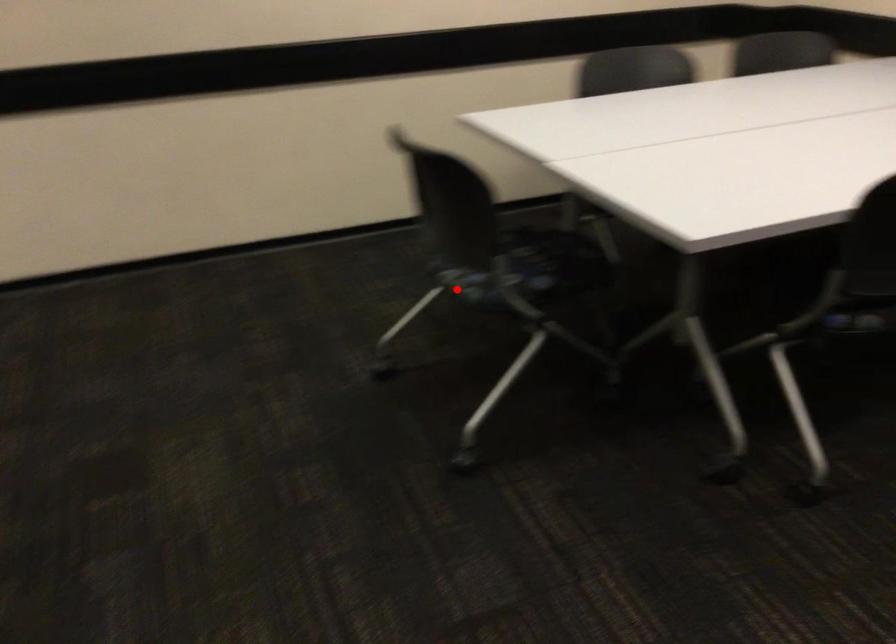
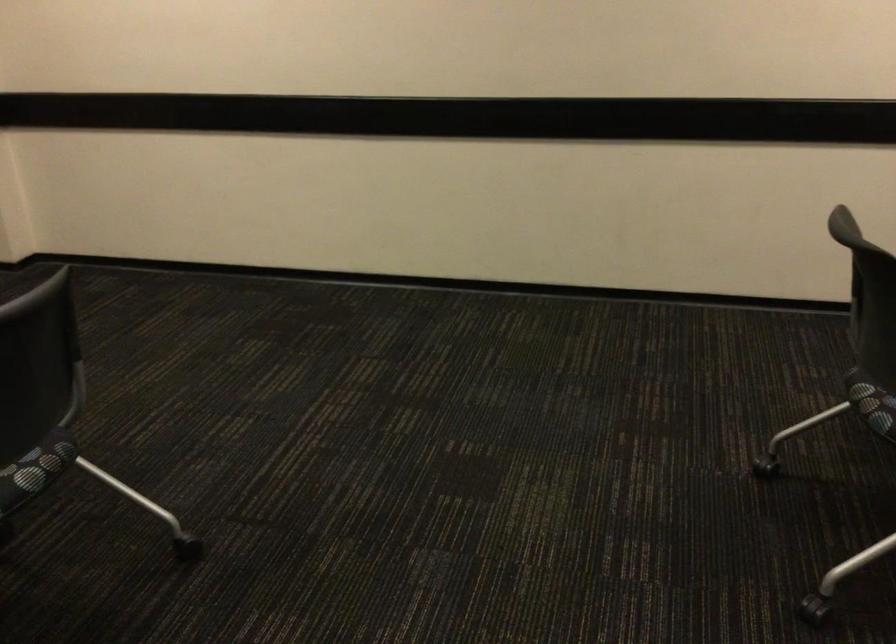
Question: I am providing you with two images of the same scene from different viewpoints. Image1 has a red point marked. In image2, the corresponding 3D location appears at what relative position? Reply with the corresponding letter.

Choices:
 (A) Closer
 (B) Farther

Answer: (A)